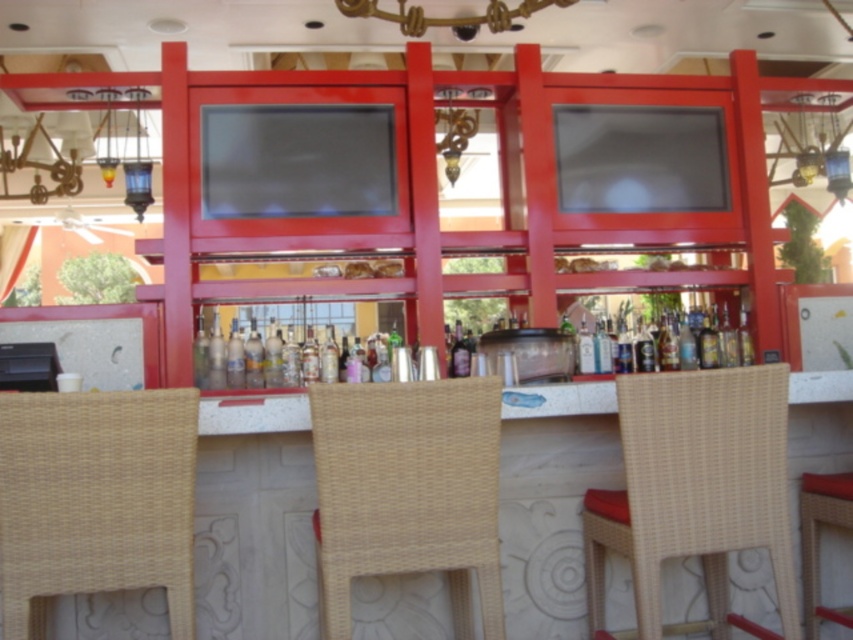
Is woven beige chair at center thinner than translucent glass bottle at center?

In fact, woven beige chair at center might be wider than translucent glass bottle at center.

From the picture: Who is more distant from viewer, (318, 428) or (256, 365)?

The point (256, 365) is behind.

Identify the location of woven beige chair at center. Image resolution: width=853 pixels, height=640 pixels. (407, 492).

Can you confirm if woven beige chair at lower left is shorter than woven rattan chair at center?

Yes, woven beige chair at lower left is shorter than woven rattan chair at center.

Where is `woven beige chair at lower left`? Image resolution: width=853 pixels, height=640 pixels. woven beige chair at lower left is located at coordinates coord(96,499).

This screenshot has width=853, height=640. Identify the location of woven beige chair at lower left. (96, 499).

Who is more distant from viewer, (x=381, y=481) or (x=816, y=529)?

Positioned behind is point (x=816, y=529).

Is woven beige chair at center further to camera compared to woven rattan bar stool at lower right?

No.

I want to click on woven beige chair at center, so click(x=407, y=492).